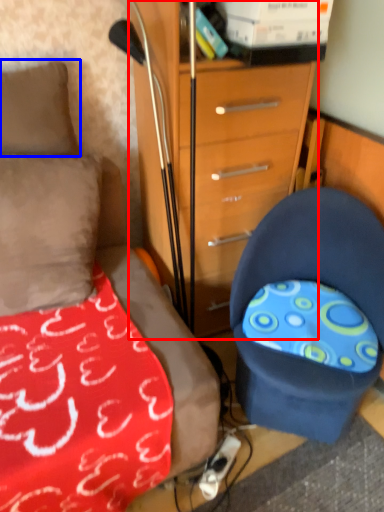
Question: Which object appears closest to the camera in this image, chest of drawers (highlighted by a red box) or pillow (highlighted by a blue box)?

Choices:
 (A) chest of drawers
 (B) pillow

Answer: (A)